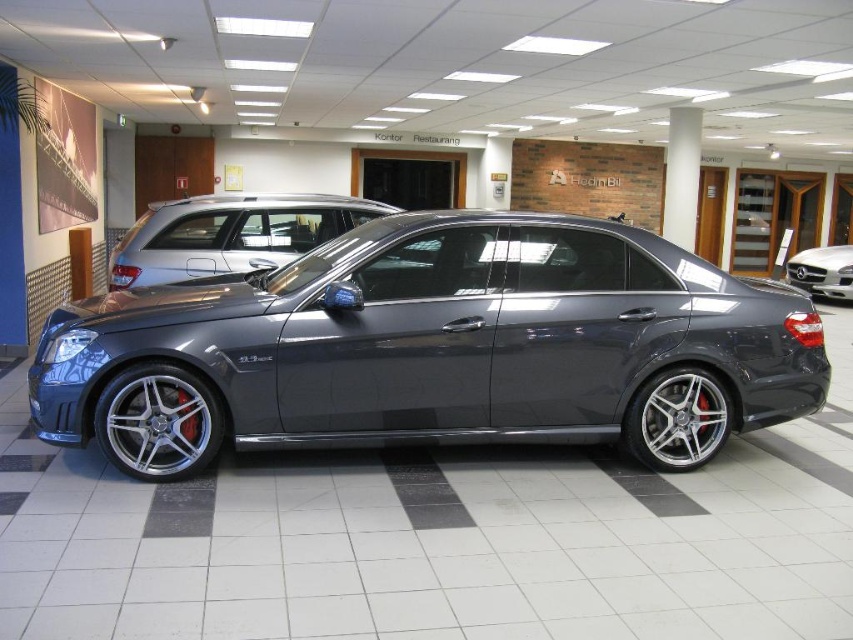
You are a car enthusiast visiting the showroom and want to know which car is taller between the satin metallic car at center and the satin black sedan at center. Can you tell me which one is taller?

The satin metallic car at center is taller than the satin black sedan at center.

You are a photographer standing at the camera position in the showroom. The satin metallic sedan at center is your subject. If your camera has a focal length of 50mm and you want to capture the entire sedan in the frame without moving closer, what adjustment can you make to ensure the sedan fits within the photo?

You can adjust the camera to a wider focal length, such as 35mm or 24mm, to capture the entire satin metallic sedan at center in the frame without moving closer. The current distance of 5.44 meters may require a wider angle to include the entire vehicle.